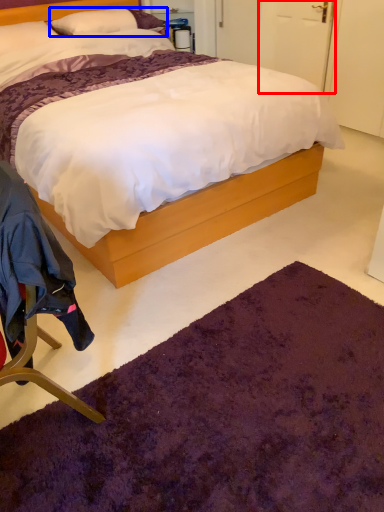
Question: Which point is closer to the camera, door (highlighted by a red box) or pillow (highlighted by a blue box)?

Choices:
 (A) door
 (B) pillow

Answer: (B)